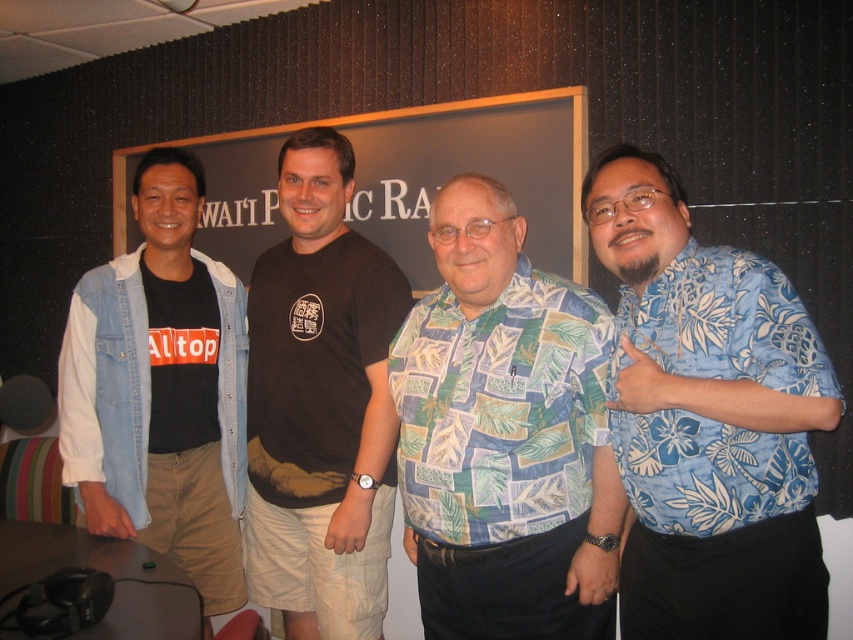
You are standing in the studio and want to hand a microphone to the person wearing the blue floral shirt at right. Given that you can reach 1.2 meters, will you be able to reach them without moving?

The distance between you and the blue floral shirt at right is 1.19 meters, which is within your 1.2 meter reach. Therefore, you can hand the microphone to them without moving.

You are a photographer positioned in front of the studio setup. You notice the blue floral shirt at right and the matte black signboard at center. Which object is nearer to your current position?

The blue floral shirt at right is closer to the viewer than the matte black signboard at center, so the blue floral shirt at right is nearer to your current position.

You are a fashion designer observing the studio scene. You need to determine the spatial arrangement of the clothing items worn by the people. Which clothing item is positioned to the right of the other between the printed fabric shirt at center and the denim jacket at left?

The printed fabric shirt at center is positioned to the right of the denim jacket at left.